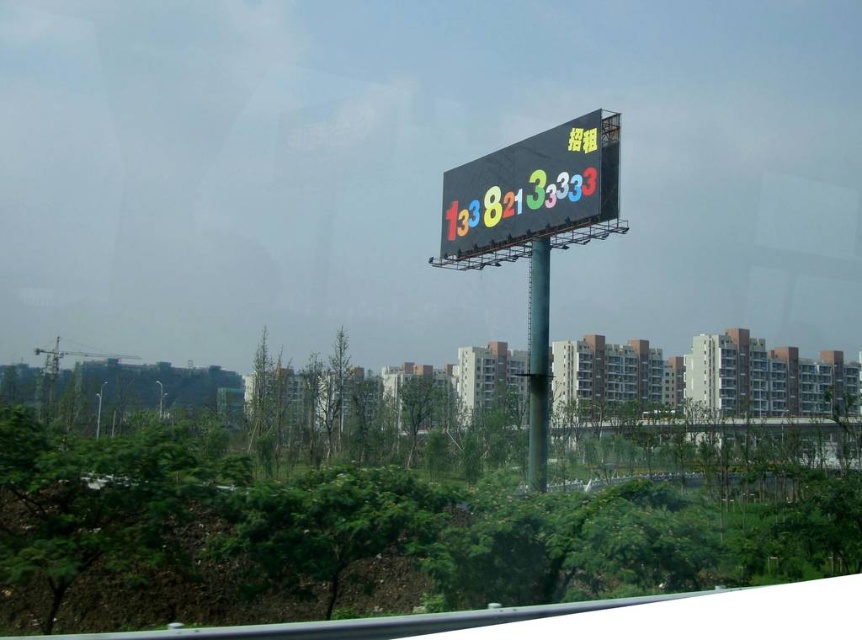
Question: Is multicolored digital display at center to the left of green metallic pole at center from the viewer's perspective?

Choices:
 (A) yes
 (B) no

Answer: (A)

Question: Does multicolored digital display at center have a larger size compared to green metallic pole at center?

Choices:
 (A) no
 (B) yes

Answer: (B)

Question: Does multicolored digital display at center appear under green metallic pole at center?

Choices:
 (A) yes
 (B) no

Answer: (B)